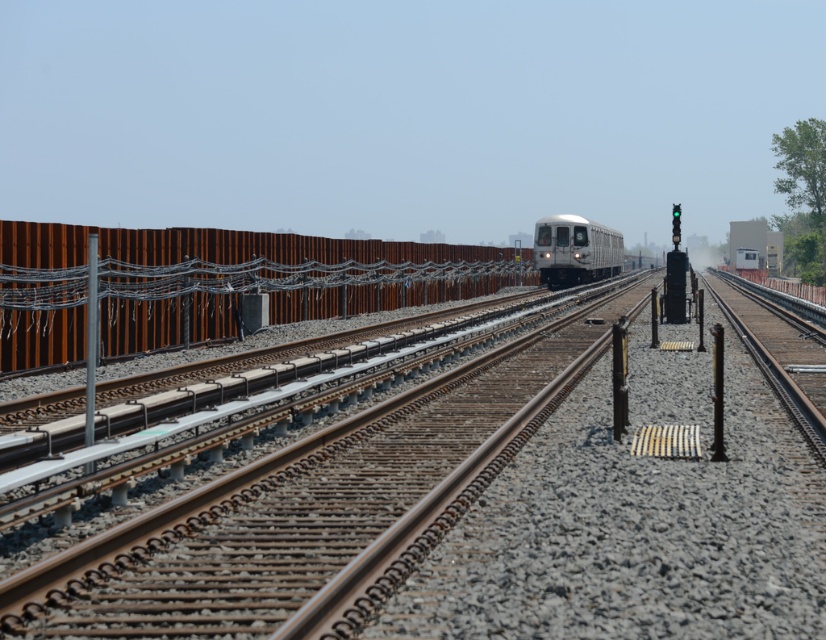
Who is lower down, brown metal train track at center or silver metallic train at center?

Positioned lower is brown metal train track at center.

Who is positioned more to the left, brown metal train track at center or silver metallic train at center?

brown metal train track at center is more to the left.

The height and width of the screenshot is (640, 826). Find the location of `brown metal train track at center`. brown metal train track at center is located at coordinates (295, 508).

Where is `brown metal train track at center`? The width and height of the screenshot is (826, 640). brown metal train track at center is located at coordinates (295, 508).

Is brown metal train track at center positioned in front of metallic pole at left?

Yes, brown metal train track at center is closer to the viewer.

At what (x,y) coordinates should I click in order to perform the action: click on brown metal train track at center. Please return your answer as a coordinate pair (x, y). Looking at the image, I should click on (295, 508).

Which is more to the left, silver metallic train at center or metallic pole at left?

metallic pole at left is more to the left.

Does silver metallic train at center appear on the right side of metallic pole at left?

Yes, silver metallic train at center is to the right of metallic pole at left.

Between point (606, 237) and point (95, 253), which one is positioned in front?

Point (95, 253) is in front.

What are the coordinates of `silver metallic train at center` in the screenshot? It's located at (575, 250).